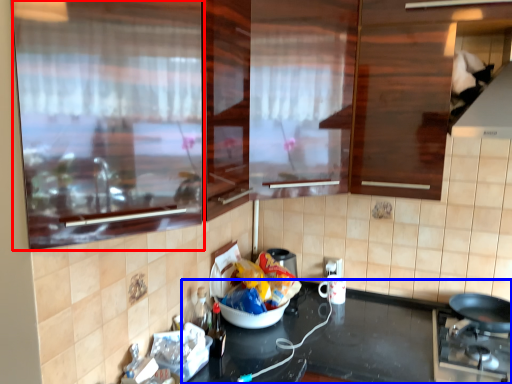
Question: Among these objects, which one is nearest to the camera, glass door (highlighted by a red box) or countertop (highlighted by a blue box)?

Choices:
 (A) glass door
 (B) countertop

Answer: (A)